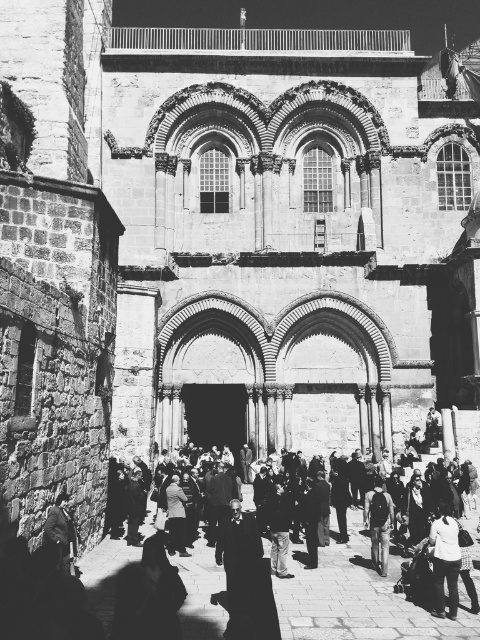
Question: Can you confirm if white cotton shirt at lower right is thinner than dark gray backpack at center?

Choices:
 (A) yes
 (B) no

Answer: (B)

Question: Is white cotton shirt at lower right wider than dark gray backpack at center?

Choices:
 (A) no
 (B) yes

Answer: (B)

Question: Considering the relative positions of white cotton shirt at lower right and dark gray backpack at center in the image provided, where is white cotton shirt at lower right located with respect to dark gray backpack at center?

Choices:
 (A) right
 (B) left

Answer: (A)

Question: Considering the real-world distances, which object is closest to the white cotton shirt at lower right?

Choices:
 (A) dark wool coat at lower left
 (B) dark gray backpack at center

Answer: (B)

Question: Which is nearer to the dark gray backpack at center?

Choices:
 (A) dark wool coat at lower left
 (B) white cotton shirt at lower right

Answer: (B)

Question: Among these points, which one is farthest from the camera?

Choices:
 (A) (68, 554)
 (B) (386, 548)

Answer: (B)